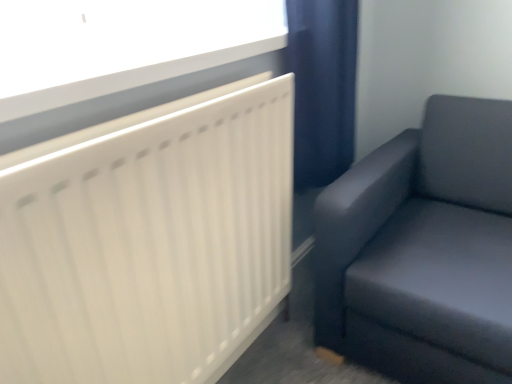
Question: Looking at the image, does matte gray couch at right seem bigger or smaller compared to white plastic window sill at upper left?

Choices:
 (A) small
 (B) big

Answer: (B)

Question: Considering the positions of matte gray couch at right and white plastic window sill at upper left in the image, is matte gray couch at right taller or shorter than white plastic window sill at upper left?

Choices:
 (A) tall
 (B) short

Answer: (A)

Question: Considering the real-world distances, which object is closest to the matte gray couch at right?

Choices:
 (A) white matte radiator at upper left
 (B) white plastic window sill at upper left

Answer: (A)

Question: Which object is the closest to the white matte radiator at upper left?

Choices:
 (A) matte gray couch at right
 (B) white plastic window sill at upper left

Answer: (B)